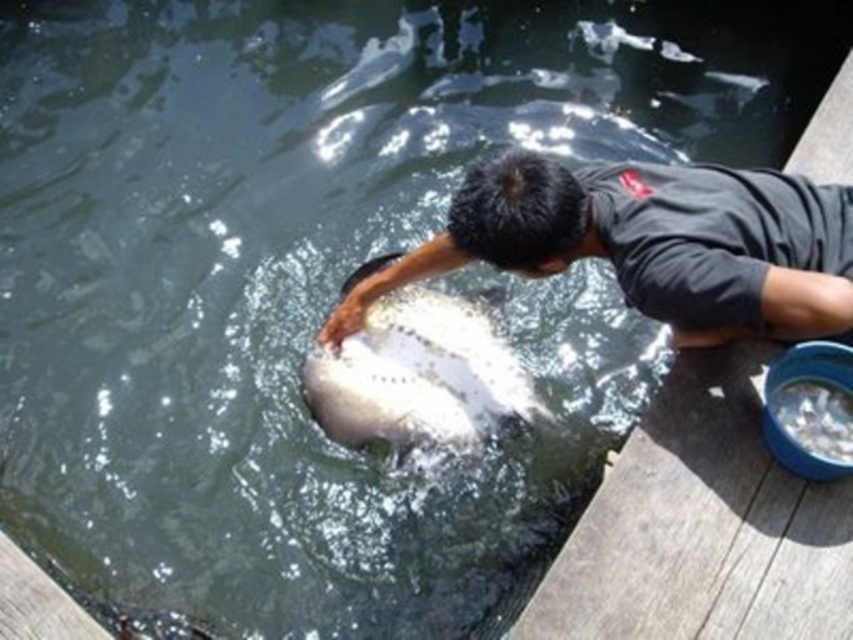
You are a photographer trying to capture the scene of the dark gray shirt at upper center and the white speckled fish at center. Which object should you focus on first if you want to ensure both are in the frame without moving the camera?

The dark gray shirt at upper center has a larger width than the white speckled fish at center, so focusing on the dark gray shirt at upper center first will help ensure both are in the frame since it occupies more space.

You are a delivery drone carrying a package that needs to land on the wooden dock at lower right. You are currently hovering near the dark gray shirt at upper center. Can you safely land on the dock without needing to move more than 20 inches from your current position?

The distance between the wooden dock at lower right and the dark gray shirt at upper center is 19.76 inches, which is within the 20 inch limit. Therefore, the drone can safely land on the wooden dock at lower right without moving more than 20 inches from its current position.